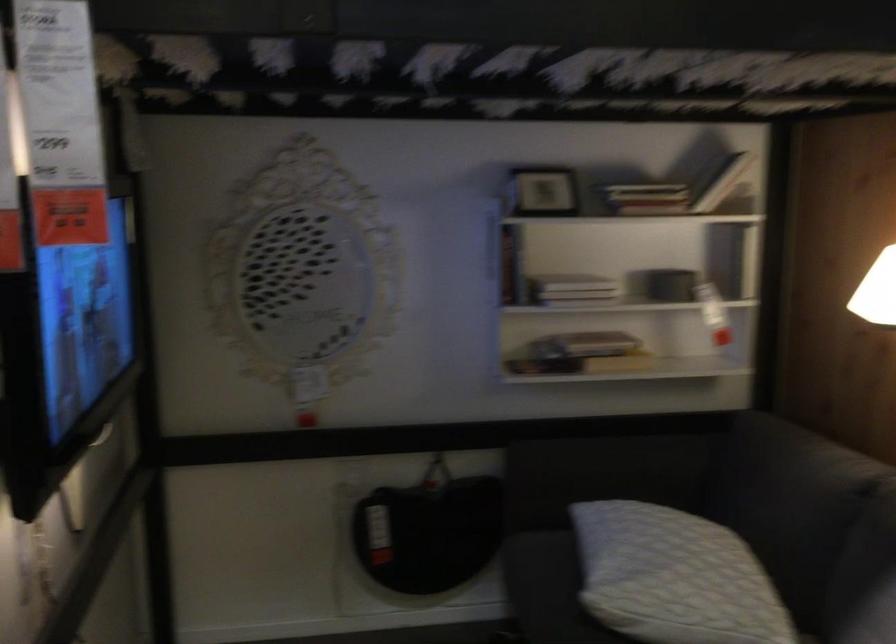
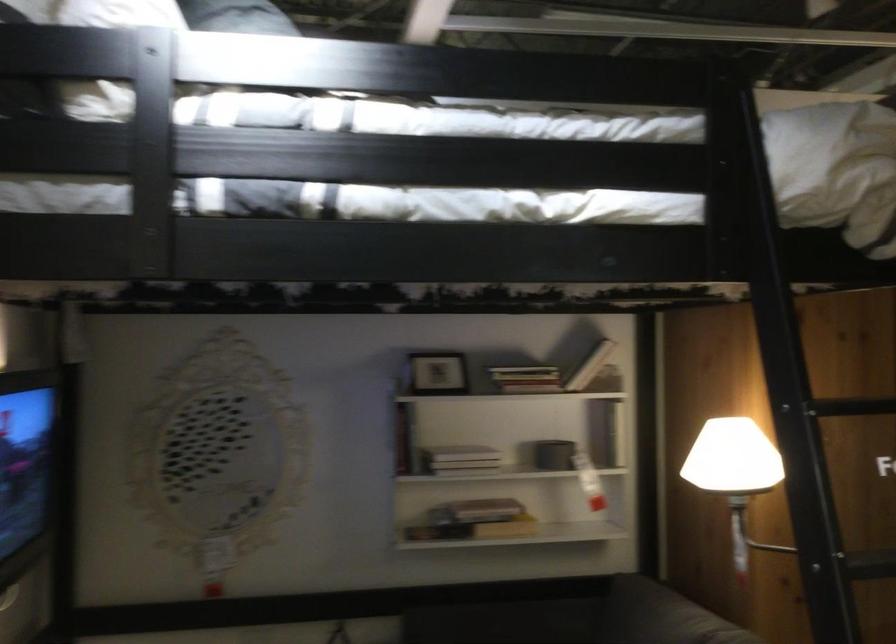
The point at (x=670, y=276) is marked in the first image. Where is the corresponding point in the second image?

(553, 453)